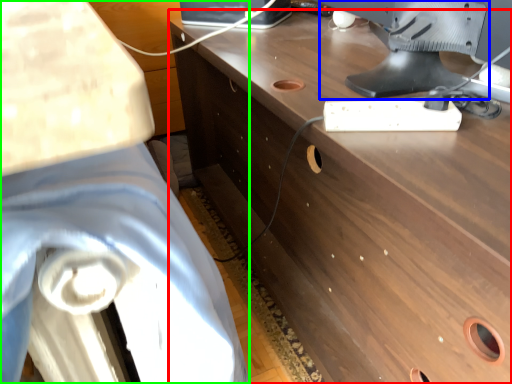
Question: Which object is the farthest from desk (highlighted by a red box)? Choose among these: computer monitor (highlighted by a blue box) or swivel chair (highlighted by a green box).

Choices:
 (A) computer monitor
 (B) swivel chair

Answer: (B)